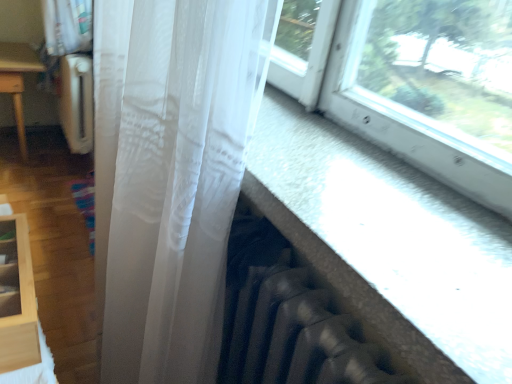
I want to click on transparent fabric at lower right, so click(389, 243).

Image resolution: width=512 pixels, height=384 pixels. What do you see at coordinates (170, 174) in the screenshot? I see `translucent white curtain at center` at bounding box center [170, 174].

This screenshot has width=512, height=384. What are the coordinates of `transparent fabric at lower right` in the screenshot? It's located at (389, 243).

Is light wood shelf at lower left facing towards translucent white curtain at center?

No, light wood shelf at lower left is not oriented towards translucent white curtain at center.

Can translucent white curtain at center be found inside light wood shelf at lower left?

No, translucent white curtain at center is not a part of light wood shelf at lower left.

Does light wood shelf at lower left have a smaller size compared to translucent white curtain at center?

Yes, light wood shelf at lower left is smaller than translucent white curtain at center.

This screenshot has height=384, width=512. Identify the location of curtain located on the right of light wood shelf at lower left. (170, 174).

Would you say transparent fabric at lower right is part of translucent white curtain at center's contents?

No, transparent fabric at lower right is not surrounded by translucent white curtain at center.

Can you confirm if translucent white curtain at center is bigger than transparent fabric at lower right?

Yes, translucent white curtain at center is bigger than transparent fabric at lower right.

Is translucent white curtain at center in contact with transparent fabric at lower right?

No, translucent white curtain at center is not with transparent fabric at lower right.

Does point (158, 128) appear closer or farther from the camera than point (417, 204)?

Point (158, 128) is positioned farther from the camera compared to point (417, 204).

What's the angular difference between light wood shelf at lower left and transparent fabric at lower right's facing directions?

1.95 degrees.

Can you confirm if light wood shelf at lower left is smaller than transparent fabric at lower right?

Indeed, light wood shelf at lower left has a smaller size compared to transparent fabric at lower right.

Which object is thinner, light wood shelf at lower left or transparent fabric at lower right?

light wood shelf at lower left is thinner.

Is the surface of light wood shelf at lower left in direct contact with transparent fabric at lower right?

No, light wood shelf at lower left is not making contact with transparent fabric at lower right.

Between transparent fabric at lower right and translucent white curtain at center, which one has less height?

transparent fabric at lower right is shorter.

Would you say transparent fabric at lower right is outside translucent white curtain at center?

Yes.

Between transparent fabric at lower right and translucent white curtain at center, which one appears on the right side from the viewer's perspective?

transparent fabric at lower right.

The width and height of the screenshot is (512, 384). In order to click on window that appears above the light wood shelf at lower left (from the image's perspective) in this screenshot , I will do `click(389, 243)`.

From a real-world perspective, is transparent fabric at lower right physically below light wood shelf at lower left?

No, from a real-world perspective, transparent fabric at lower right is not beneath light wood shelf at lower left.

Does transparent fabric at lower right appear on the right side of light wood shelf at lower left?

Correct, you'll find transparent fabric at lower right to the right of light wood shelf at lower left.

Based on the photo, from the image's perspective, is transparent fabric at lower right beneath light wood shelf at lower left?

Incorrect, from the image's perspective, transparent fabric at lower right is higher than light wood shelf at lower left.

Considering the points (175, 171) and (5, 230), which point is in front, point (175, 171) or point (5, 230)?

The point (175, 171) is closer.

Considering the sizes of objects translucent white curtain at center and light wood shelf at lower left in the image provided, who is bigger, translucent white curtain at center or light wood shelf at lower left?

Bigger between the two is translucent white curtain at center.

Does translucent white curtain at center have a greater width compared to light wood shelf at lower left?

Yes, translucent white curtain at center is wider than light wood shelf at lower left.

From the image's perspective, is translucent white curtain at center beneath light wood shelf at lower left?

Correct, translucent white curtain at center appears lower than light wood shelf at lower left in the image.

Where is `curtain lying on the right of light wood shelf at lower left`? curtain lying on the right of light wood shelf at lower left is located at coordinates (170, 174).

Where is `window in front of the translucent white curtain at center`? window in front of the translucent white curtain at center is located at coordinates (389, 243).

Based on their spatial positions, is transparent fabric at lower right or translucent white curtain at center closer to light wood shelf at lower left?

translucent white curtain at center is positioned closer to the anchor light wood shelf at lower left.

Which object lies nearer to the anchor point light wood shelf at lower left, translucent white curtain at center or transparent fabric at lower right?

Among the two, translucent white curtain at center is located nearer to light wood shelf at lower left.

Looking at the image, which one is located closer to translucent white curtain at center, transparent fabric at lower right or light wood shelf at lower left?

transparent fabric at lower right lies closer to translucent white curtain at center than the other object.

When comparing their distances from transparent fabric at lower right, does light wood shelf at lower left or translucent white curtain at center seem closer?

Based on the image, translucent white curtain at center appears to be nearer to transparent fabric at lower right.

When comparing their distances from transparent fabric at lower right, does translucent white curtain at center or light wood shelf at lower left seem closer?

translucent white curtain at center lies closer to transparent fabric at lower right than the other object.

Which object lies further to the anchor point translucent white curtain at center, light wood shelf at lower left or transparent fabric at lower right?

The object further to translucent white curtain at center is light wood shelf at lower left.

Identify the location of curtain situated between light wood shelf at lower left and transparent fabric at lower right from left to right. (170, 174).